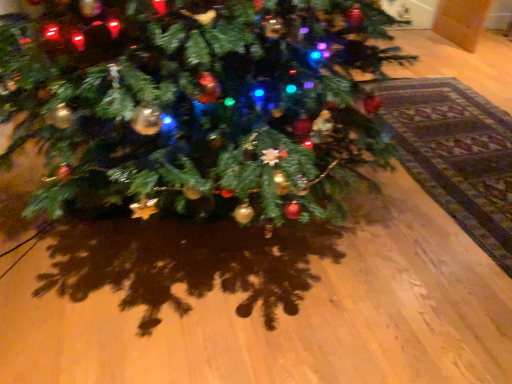
The width and height of the screenshot is (512, 384). I want to click on green matte christmas tree at center, so click(x=195, y=105).

In order to face green matte christmas tree at center, should I rotate leftwards or rightwards?

To align with it, rotate left about 8.205°.

The image size is (512, 384). What do you see at coordinates (195, 105) in the screenshot?
I see `green matte christmas tree at center` at bounding box center [195, 105].

What are the coordinates of `green matte christmas tree at center` in the screenshot? It's located at (195, 105).